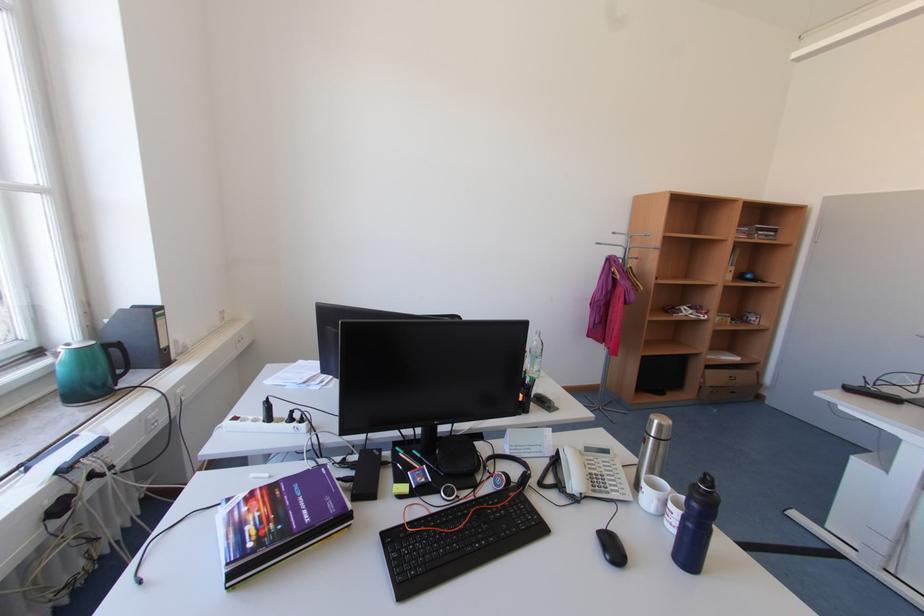
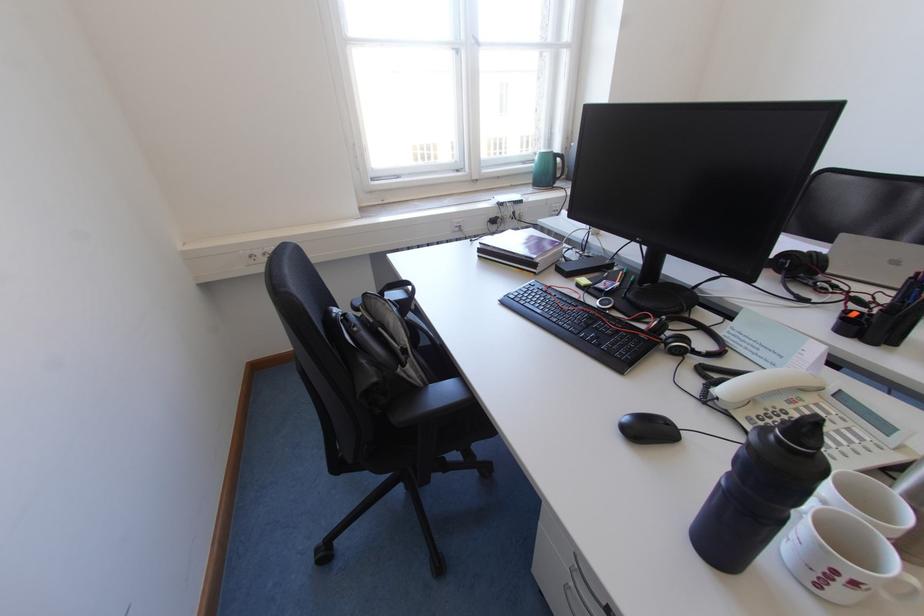
The point at (235, 589) is marked in the first image. Where is the corresponding point in the second image?

(487, 257)